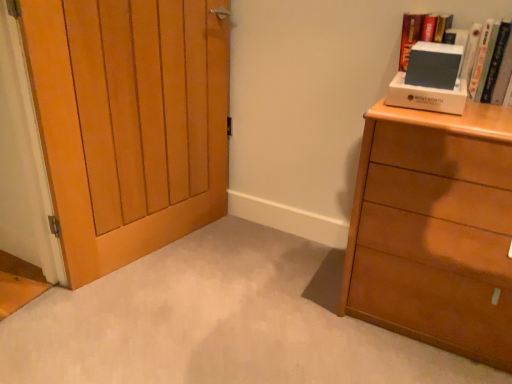
Identify the location of vacant space to the right of wooden door at left. (237, 252).